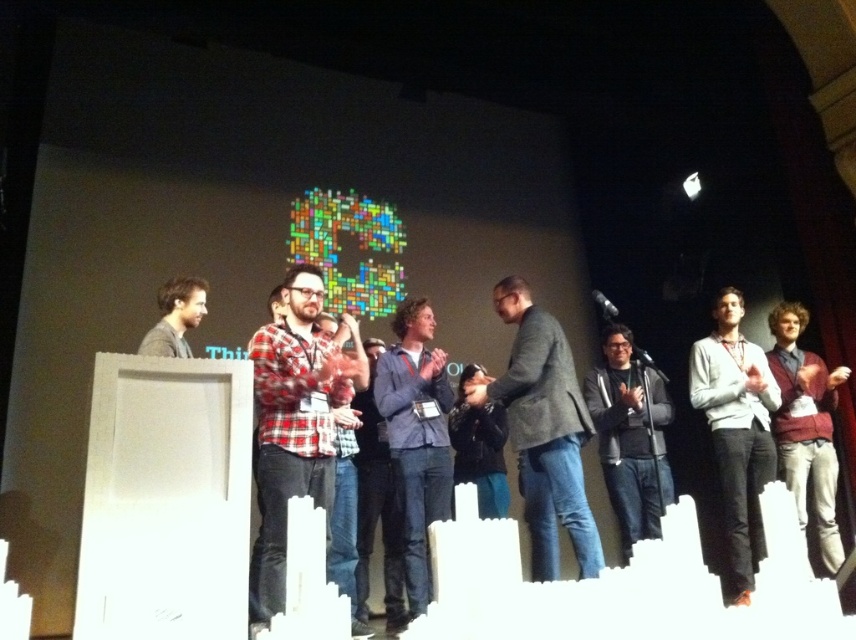
Question: Which point is closer to the camera?

Choices:
 (A) maroon sweater at right
 (B) dark gray jacket at center
 (C) gray sweater at center
 (D) blue denim jeans at center

Answer: (C)

Question: Can you confirm if dark gray suit at center is smaller than gray sweater at center?

Choices:
 (A) no
 (B) yes

Answer: (A)

Question: Is gray sweater at center below black metallic microphone at center?

Choices:
 (A) no
 (B) yes

Answer: (B)

Question: Which point is closer to the camera?

Choices:
 (A) (532, 529)
 (B) (453, 396)
 (C) (265, 545)
 (D) (598, 291)

Answer: (C)

Question: Among these points, which one is nearest to the camera?

Choices:
 (A) (199, 307)
 (B) (592, 378)
 (C) (377, 401)
 (D) (571, 444)

Answer: (D)

Question: Can you confirm if plaid flannel shirt at center is smaller than maroon sweater at right?

Choices:
 (A) yes
 (B) no

Answer: (B)